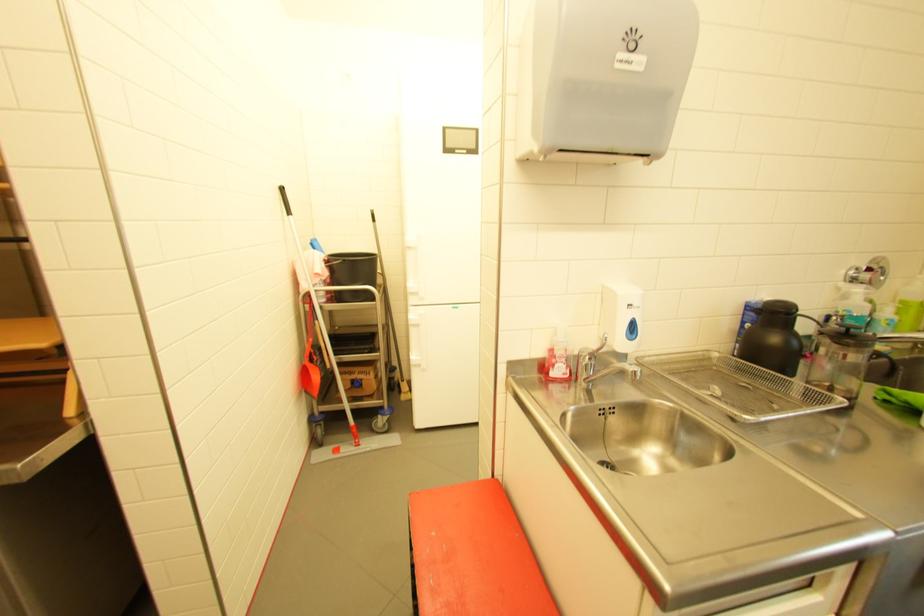
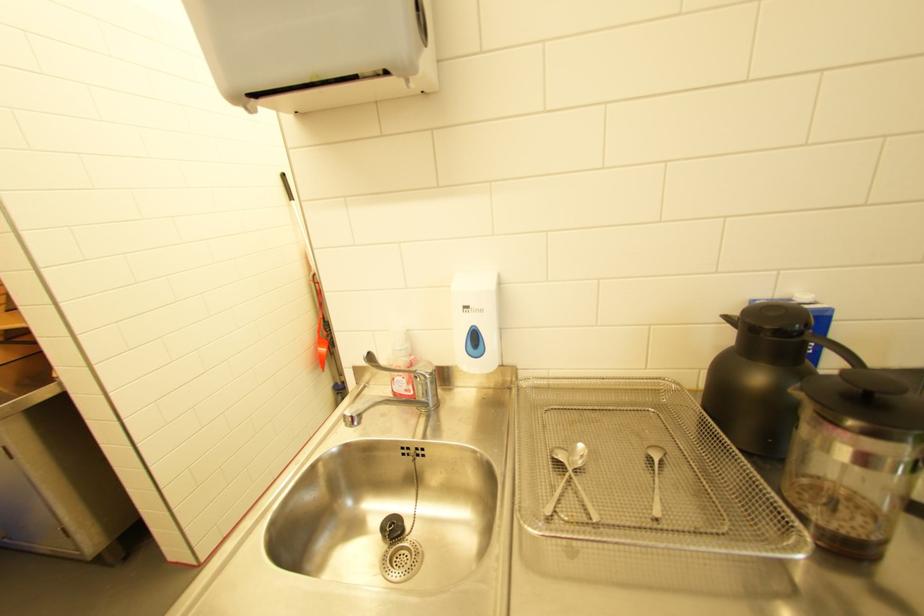
The images are taken continuously from a first-person perspective. In which direction are you moving?

The movement direction of the cameraman is right, forward.